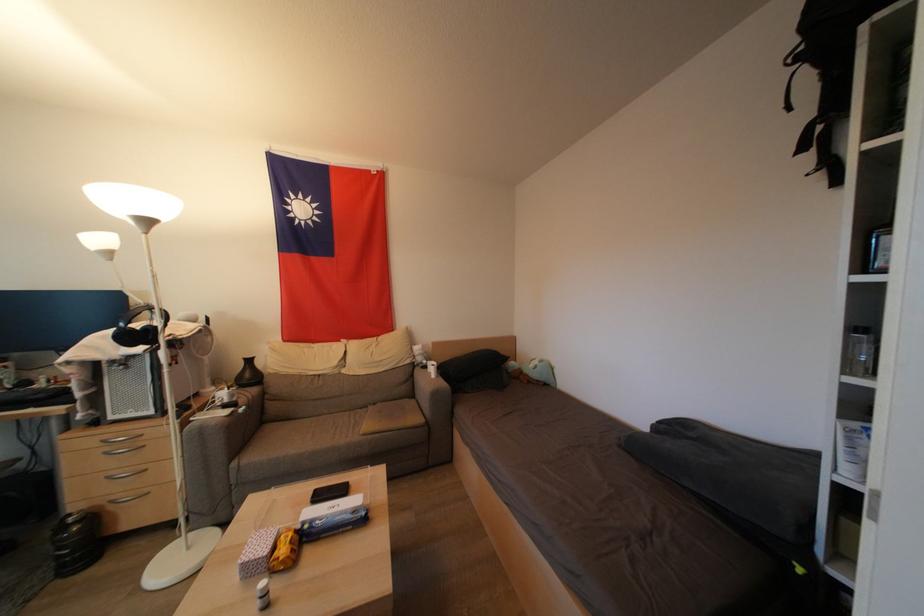
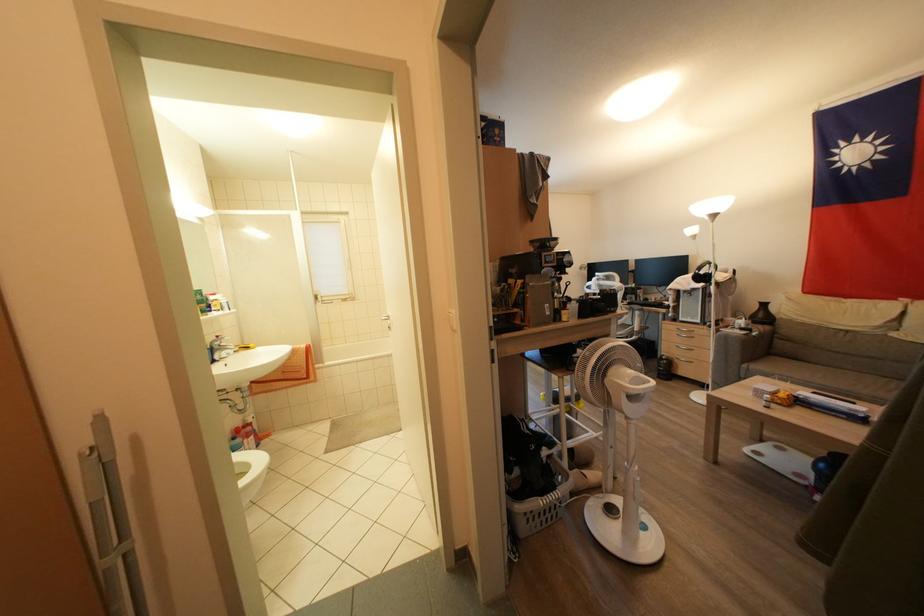
Find the pixel in the second image that matches (x=116, y=421) in the first image.

(686, 323)